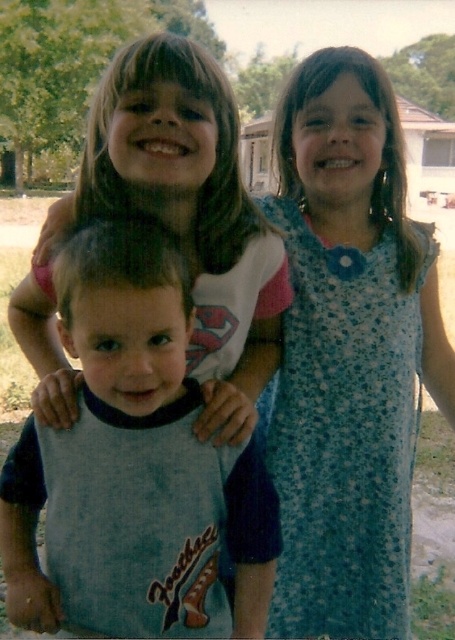
Question: Is blue floral dress at upper right to the left of matte white shirt at upper center from the viewer's perspective?

Choices:
 (A) no
 (B) yes

Answer: (A)

Question: Is blue cotton shirt at center to the right of matte white shirt at upper center from the viewer's perspective?

Choices:
 (A) no
 (B) yes

Answer: (A)

Question: Which of the following is the farthest from the observer?

Choices:
 (A) blue cotton shirt at center
 (B) matte white shirt at upper center

Answer: (B)

Question: Among these objects, which one is farthest from the camera?

Choices:
 (A) matte white shirt at upper center
 (B) blue floral dress at upper right

Answer: (B)

Question: Which object is closer to the camera taking this photo?

Choices:
 (A) blue floral dress at upper right
 (B) matte white shirt at upper center
 (C) blue cotton shirt at center

Answer: (C)

Question: In this image, where is blue cotton shirt at center located relative to matte white shirt at upper center?

Choices:
 (A) below
 (B) above

Answer: (A)